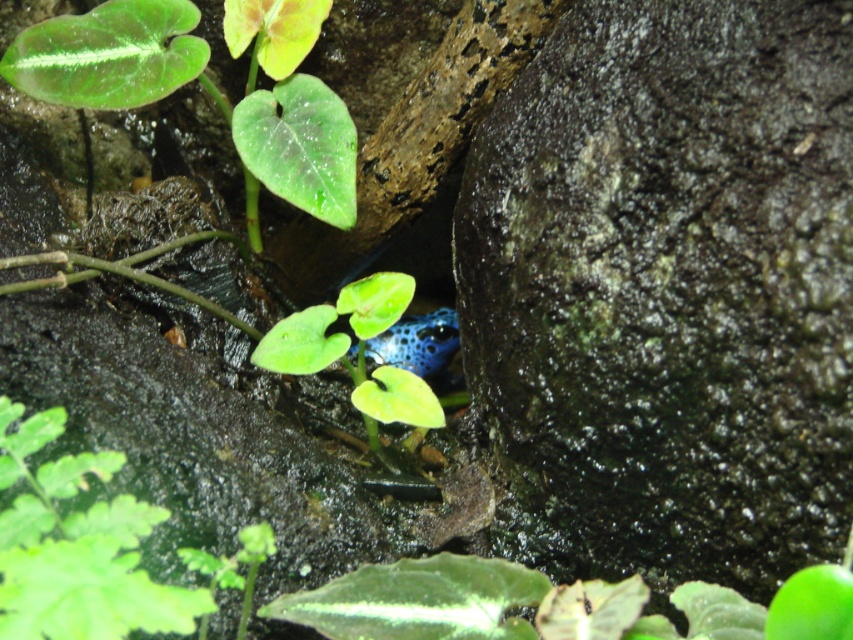
Question: Does green glossy leaf at upper left have a smaller size compared to green matte leaf at center?

Choices:
 (A) yes
 (B) no

Answer: (B)

Question: Is green glossy leaf at upper left positioned in front of green matte leaf at center?

Choices:
 (A) no
 (B) yes

Answer: (A)

Question: Among these objects, which one is farthest from the camera?

Choices:
 (A) green leafy plant at lower left
 (B) green matte leaf at center

Answer: (B)

Question: Considering the relative positions of green leafy plant at lower left and green matte leaf at center in the image provided, where is green leafy plant at lower left located with respect to green matte leaf at center?

Choices:
 (A) below
 (B) above

Answer: (A)

Question: Which object appears farthest from the camera in this image?

Choices:
 (A) green leafy plant at lower left
 (B) green glossy leaf at upper left

Answer: (B)

Question: Which point is closer to the camera?

Choices:
 (A) coord(15,412)
 (B) coord(115,84)

Answer: (A)